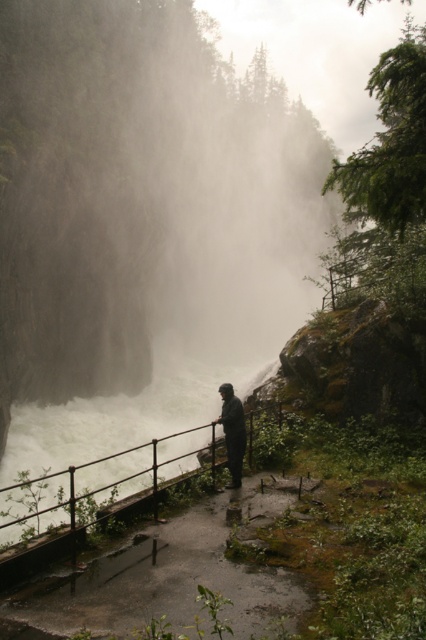
Is black metal railing at lower center to the right of dark matte jacket at center from the viewer's perspective?

Incorrect, black metal railing at lower center is not on the right side of dark matte jacket at center.

Which is above, black metal railing at lower center or dark matte jacket at center?

dark matte jacket at center is above.

Who is more forward, (201, 465) or (224, 438)?

Point (224, 438) is more forward.

Identify the location of black metal railing at lower center. This screenshot has height=640, width=426. (141, 472).